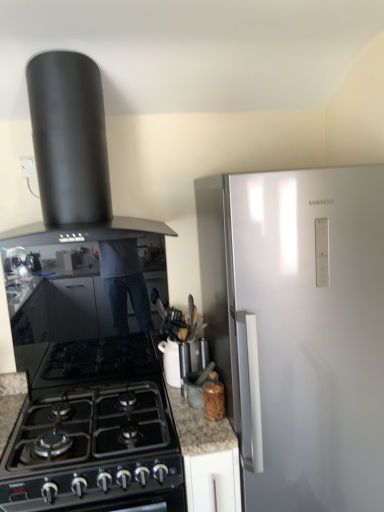
What is the approximate height of black glass gas stove at lower left?

black glass gas stove at lower left is 15.85 centimeters tall.

Measure the distance between point (x=90, y=342) and camera.

A distance of 1.94 meters exists between point (x=90, y=342) and camera.

How much space does white glossy teapot at center, arranged as the second kitchen appliance when ordered from the bottom, occupy horizontally?

7.40 inches.

Describe the element at coordinates (71, 156) in the screenshot. I see `black matte chimney hood at upper left, arranged as the 1th kitchen appliance when viewed from the top` at that location.

This screenshot has height=512, width=384. Find the location of `black glass gas stove at lower left`. black glass gas stove at lower left is located at coordinates (95, 432).

Is black glass gas stove at lower left bigger than white glossy teapot at center, which ranks as the 2th kitchen appliance in left-to-right order?

Correct, black glass gas stove at lower left is larger in size than white glossy teapot at center, which ranks as the 2th kitchen appliance in left-to-right order.

From a real-world perspective, which object rests below the other?

From a 3D spatial view, black glass gas stove at lower left is below.

Considering the positions of objects black glass gas stove at lower left and white glossy teapot at center, the 2th kitchen appliance in the right-to-left sequence, in the image provided, who is more to the right, black glass gas stove at lower left or white glossy teapot at center, the 2th kitchen appliance in the right-to-left sequence,?

From the viewer's perspective, white glossy teapot at center, the 2th kitchen appliance in the right-to-left sequence, appears more on the right side.

Is black glass gas stove at lower left next to white glossy teapot at center, the second kitchen appliance viewed from the top, and touching it?

No, black glass gas stove at lower left is not with white glossy teapot at center, the second kitchen appliance viewed from the top.

Is black matte chimney hood at upper left, positioned as the first kitchen appliance in left-to-right order, to the right of white glossy teapot at center, arranged as the second kitchen appliance when ordered from the bottom, from the viewer's perspective?

Incorrect, black matte chimney hood at upper left, positioned as the first kitchen appliance in left-to-right order, is not on the right side of white glossy teapot at center, arranged as the second kitchen appliance when ordered from the bottom.

Is black matte chimney hood at upper left, marked as the 3th kitchen appliance in a right-to-left arrangement, not within white glossy teapot at center, arranged as the second kitchen appliance when ordered from the bottom?

black matte chimney hood at upper left, marked as the 3th kitchen appliance in a right-to-left arrangement, is positioned outside white glossy teapot at center, arranged as the second kitchen appliance when ordered from the bottom.

Is the surface of black matte chimney hood at upper left, positioned as the first kitchen appliance in left-to-right order, in direct contact with white glossy teapot at center, arranged as the second kitchen appliance when ordered from the bottom?

black matte chimney hood at upper left, positioned as the first kitchen appliance in left-to-right order, and white glossy teapot at center, arranged as the second kitchen appliance when ordered from the bottom, are clearly separated.

Is the position of black matte chimney hood at upper left, positioned as the first kitchen appliance in left-to-right order, less distant than that of white glossy teapot at center, the 2th kitchen appliance in the right-to-left sequence?

Yes, black matte chimney hood at upper left, positioned as the first kitchen appliance in left-to-right order, is in front of white glossy teapot at center, the 2th kitchen appliance in the right-to-left sequence.

Can you confirm if brown glass bottle at lower center, the first kitchen appliance positioned from the bottom, is positioned to the left of white glossy teapot at center, the second kitchen appliance viewed from the top?

Incorrect, brown glass bottle at lower center, the first kitchen appliance positioned from the bottom, is not on the left side of white glossy teapot at center, the second kitchen appliance viewed from the top.

Considering the relative sizes of brown glass bottle at lower center, the first kitchen appliance positioned from the bottom, and white glossy teapot at center, the 2th kitchen appliance in the right-to-left sequence, in the image provided, is brown glass bottle at lower center, the first kitchen appliance positioned from the bottom, bigger than white glossy teapot at center, the 2th kitchen appliance in the right-to-left sequence,?

No.

Does brown glass bottle at lower center, the first kitchen appliance positioned from the bottom, have a greater width compared to white glossy teapot at center, which ranks as the 2th kitchen appliance in left-to-right order?

No.

From the image's perspective, relative to white glossy teapot at center, the 2th kitchen appliance in the right-to-left sequence, is brown glass bottle at lower center, acting as the 3th kitchen appliance starting from the top, above or below?

From the image's perspective, brown glass bottle at lower center, acting as the 3th kitchen appliance starting from the top, appears below white glossy teapot at center, the 2th kitchen appliance in the right-to-left sequence.

Is black glass gas stove at lower left turned away from brown glass bottle at lower center, placed as the first kitchen appliance when sorted from right to left?

No.

Would you consider black glass gas stove at lower left to be distant from brown glass bottle at lower center, placed as the first kitchen appliance when sorted from right to left?

They are positioned close to each other.

From their relative heights in the image, would you say black glass gas stove at lower left is taller or shorter than brown glass bottle at lower center, acting as the 3th kitchen appliance starting from the top?

black glass gas stove at lower left is shorter than brown glass bottle at lower center, acting as the 3th kitchen appliance starting from the top.

Which is nearer, (102, 483) or (210, 380)?

The point (102, 483) is more forward.

From a real-world perspective, is white glossy teapot at center, arranged as the second kitchen appliance when ordered from the bottom, above or below black glass gas stove at lower left?

white glossy teapot at center, arranged as the second kitchen appliance when ordered from the bottom, is above black glass gas stove at lower left.

Is point (163, 352) farther from viewer compared to point (77, 444)?

That is True.

Is white glossy teapot at center, which ranks as the 2th kitchen appliance in left-to-right order, oriented away from black glass gas stove at lower left?

No, black glass gas stove at lower left is not at the back of white glossy teapot at center, which ranks as the 2th kitchen appliance in left-to-right order.

Is white glossy teapot at center, arranged as the second kitchen appliance when ordered from the bottom, wider or thinner than black matte chimney hood at upper left, marked as the 3th kitchen appliance in a bottom-to-top arrangement?

white glossy teapot at center, arranged as the second kitchen appliance when ordered from the bottom, is thinner than black matte chimney hood at upper left, marked as the 3th kitchen appliance in a bottom-to-top arrangement.

Does point (168, 351) come behind point (57, 110)?

Yes.

Considering the sizes of objects white glossy teapot at center, the second kitchen appliance viewed from the top, and black matte chimney hood at upper left, positioned as the first kitchen appliance in left-to-right order, in the image provided, who is bigger, white glossy teapot at center, the second kitchen appliance viewed from the top, or black matte chimney hood at upper left, positioned as the first kitchen appliance in left-to-right order,?

black matte chimney hood at upper left, positioned as the first kitchen appliance in left-to-right order.

Does white glossy teapot at center, the second kitchen appliance viewed from the top, appear on the left side of black matte chimney hood at upper left, arranged as the 1th kitchen appliance when viewed from the top?

No.

Considering the relative sizes of brown glass bottle at lower center, which is counted as the third kitchen appliance, starting from the left, and black glass gas stove at lower left in the image provided, is brown glass bottle at lower center, which is counted as the third kitchen appliance, starting from the left, shorter than black glass gas stove at lower left?

No, brown glass bottle at lower center, which is counted as the third kitchen appliance, starting from the left, is not shorter than black glass gas stove at lower left.

Is black glass gas stove at lower left at the back of brown glass bottle at lower center, placed as the first kitchen appliance when sorted from right to left?

No, brown glass bottle at lower center, placed as the first kitchen appliance when sorted from right to left,'s orientation is not away from black glass gas stove at lower left.

In terms of size, does brown glass bottle at lower center, placed as the first kitchen appliance when sorted from right to left, appear bigger or smaller than black glass gas stove at lower left?

In the image, brown glass bottle at lower center, placed as the first kitchen appliance when sorted from right to left, appears to be smaller than black glass gas stove at lower left.

The image size is (384, 512). Identify the location of gas stove below the white glossy teapot at center, the second kitchen appliance viewed from the top (from a real-world perspective). (95, 432).

From the black matte chimney hood at upper left, arranged as the 1th kitchen appliance when viewed from the top, count 1st kitchen appliance to the right and point to it. Please provide its 2D coordinates.

[(171, 362)]

When comparing their distances from black glass gas stove at lower left, does brown glass bottle at lower center, acting as the 3th kitchen appliance starting from the top, or black matte chimney hood at upper left, positioned as the first kitchen appliance in left-to-right order, seem closer?

brown glass bottle at lower center, acting as the 3th kitchen appliance starting from the top.

Which object lies nearer to the anchor point black matte chimney hood at upper left, arranged as the 1th kitchen appliance when viewed from the top, brown glass bottle at lower center, which is counted as the third kitchen appliance, starting from the left, or black glass gas stove at lower left?

black glass gas stove at lower left is positioned closer to the anchor black matte chimney hood at upper left, arranged as the 1th kitchen appliance when viewed from the top.

Based on their spatial positions, is white glossy teapot at center, the 2th kitchen appliance in the right-to-left sequence, or black matte chimney hood at upper left, arranged as the 1th kitchen appliance when viewed from the top, closer to black glass gas stove at lower left?

white glossy teapot at center, the 2th kitchen appliance in the right-to-left sequence, is closer to black glass gas stove at lower left.

Considering their positions, is brown glass bottle at lower center, placed as the first kitchen appliance when sorted from right to left, positioned closer to black matte chimney hood at upper left, marked as the 3th kitchen appliance in a bottom-to-top arrangement, than white glossy teapot at center, arranged as the second kitchen appliance when ordered from the bottom?

white glossy teapot at center, arranged as the second kitchen appliance when ordered from the bottom, is positioned closer to the anchor black matte chimney hood at upper left, marked as the 3th kitchen appliance in a bottom-to-top arrangement.

Based on their spatial positions, is brown glass bottle at lower center, acting as the 3th kitchen appliance starting from the top, or black glass gas stove at lower left closer to white glossy teapot at center, which ranks as the 2th kitchen appliance in left-to-right order?

brown glass bottle at lower center, acting as the 3th kitchen appliance starting from the top, is positioned closer to the anchor white glossy teapot at center, which ranks as the 2th kitchen appliance in left-to-right order.

Which object lies nearer to the anchor point black matte chimney hood at upper left, arranged as the 1th kitchen appliance when viewed from the top, white glossy teapot at center, which ranks as the 2th kitchen appliance in left-to-right order, or black glass gas stove at lower left?

Based on the image, black glass gas stove at lower left appears to be nearer to black matte chimney hood at upper left, arranged as the 1th kitchen appliance when viewed from the top.

Looking at the image, which one is located closer to brown glass bottle at lower center, the first kitchen appliance positioned from the bottom, white glossy teapot at center, the 2th kitchen appliance in the right-to-left sequence, or black matte chimney hood at upper left, positioned as the first kitchen appliance in left-to-right order?

white glossy teapot at center, the 2th kitchen appliance in the right-to-left sequence, is positioned closer to the anchor brown glass bottle at lower center, the first kitchen appliance positioned from the bottom.

When comparing their distances from black matte chimney hood at upper left, marked as the 3th kitchen appliance in a bottom-to-top arrangement, does black glass gas stove at lower left or white glossy teapot at center, which ranks as the 2th kitchen appliance in left-to-right order, seem further?

white glossy teapot at center, which ranks as the 2th kitchen appliance in left-to-right order.

Locate an element on the screen. The image size is (384, 512). kitchen appliance between black matte chimney hood at upper left, positioned as the first kitchen appliance in left-to-right order, and brown glass bottle at lower center, placed as the first kitchen appliance when sorted from right to left, in the up-down direction is located at coordinates (171, 362).